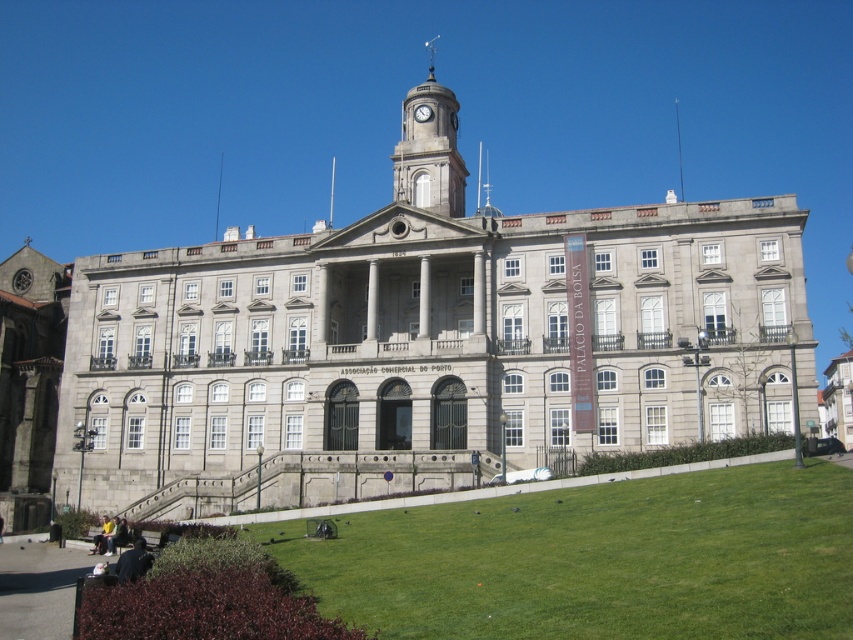
You are a drone operator tasked with flying a drone between the smooth gray clock tower at upper center and the white glossy clock at center. The drone has a maximum flight distance of 15 meters. Can the drone safely navigate the space between them without exceeding its range?

The distance between the smooth gray clock tower at upper center and the white glossy clock at center is 16.71 meters, which exceeds the drone operator maximum flight distance of 15 meters. The drone cannot safely navigate the space between them without exceeding its range.

What are the coordinates of the smooth gray clock tower at upper center in the image?

The smooth gray clock tower at upper center is located at coordinates (428, 148).

You are standing in front of the grand neoclassical building and notice two points marked on the facade. The first point is at coordinates point [543,621] and the second is at point [405,118]. From your perspective, which point appears closer to you?

Point [543,621] is in front of point [405,118], so it appears closer to you.